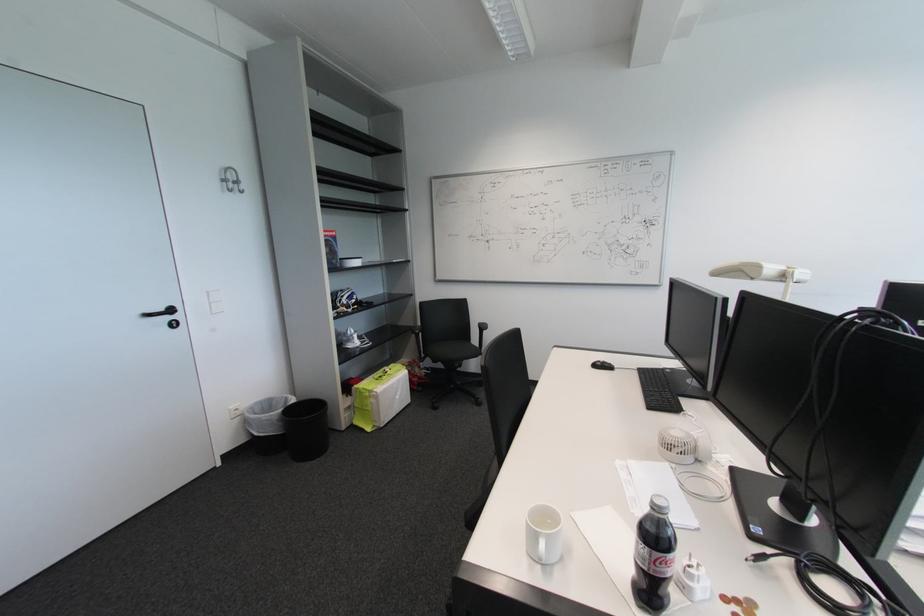
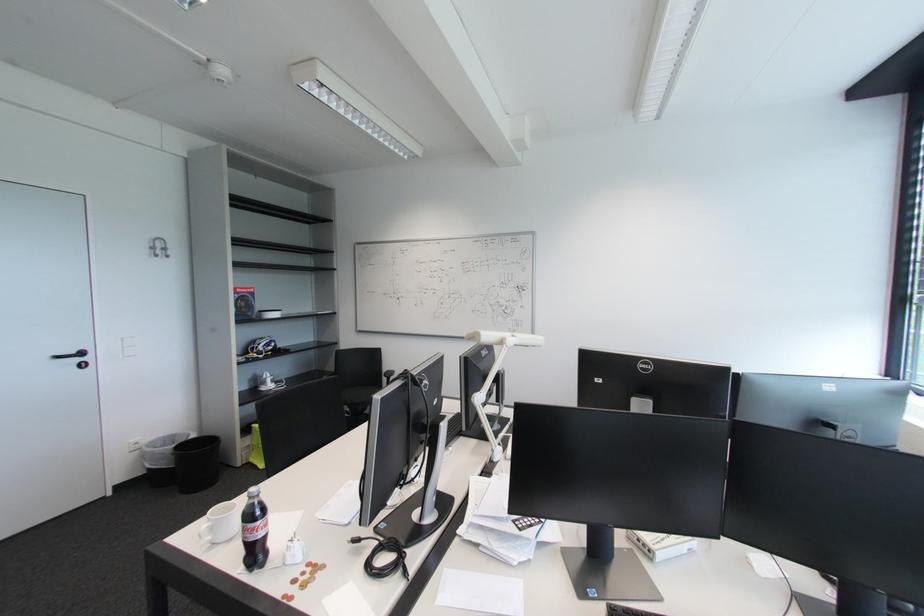
Where in the second image is the point corresponding to point (348, 299) from the first image?

(265, 346)